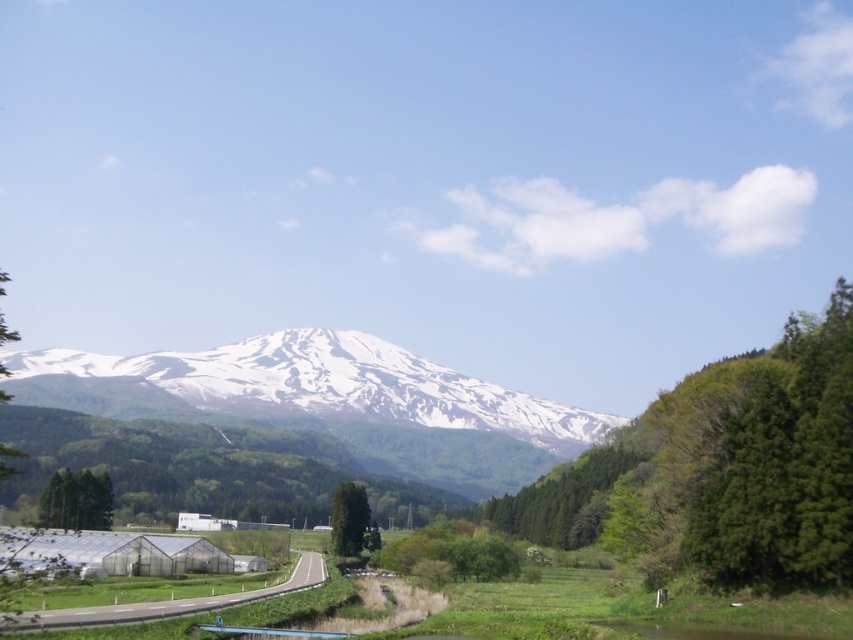
Question: Based on their relative distances, which object is nearer to the green matte tree at lower left?

Choices:
 (A) white snow-covered mountain at center
 (B) green matte tree at center

Answer: (B)

Question: Does white snow-covered mountain at center appear under green matte tree at center?

Choices:
 (A) no
 (B) yes

Answer: (A)

Question: Is white snow-covered mountain at center thinner than green matte tree at lower left?

Choices:
 (A) no
 (B) yes

Answer: (A)

Question: Is white snow-covered mountain at center thinner than green matte tree at center?

Choices:
 (A) yes
 (B) no

Answer: (B)

Question: Which point is farther from the camera taking this photo?

Choices:
 (A) (357, 541)
 (B) (146, 365)

Answer: (B)

Question: Which of the following is the closest to the observer?

Choices:
 (A) tap(106, 394)
 (B) tap(354, 502)
 (C) tap(112, 493)

Answer: (C)